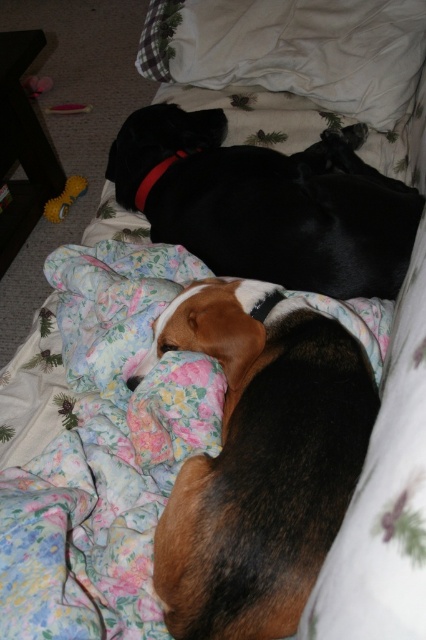
Question: Does brown and black fur at center have a smaller size compared to black smooth dog at upper center?

Choices:
 (A) yes
 (B) no

Answer: (A)

Question: Which point is farther from the camera taking this photo?

Choices:
 (A) (183, 154)
 (B) (331, 291)
 (C) (276, 627)
 (D) (155, 10)

Answer: (D)

Question: Is brown and black fur at center smaller than black smooth dog at upper center?

Choices:
 (A) yes
 (B) no

Answer: (A)

Question: Is brown and black fur at center to the left of rubber neckband at center from the viewer's perspective?

Choices:
 (A) yes
 (B) no

Answer: (B)

Question: Which object appears farthest from the camera in this image?

Choices:
 (A) rubber neckband at center
 (B) brown and black fur at center
 (C) white soft pillow at upper center
 (D) black smooth dog at upper center

Answer: (C)

Question: Which point is closer to the camera?

Choices:
 (A) white soft pillow at upper center
 (B) brown and black fur at center
 (C) rubber neckband at center

Answer: (B)